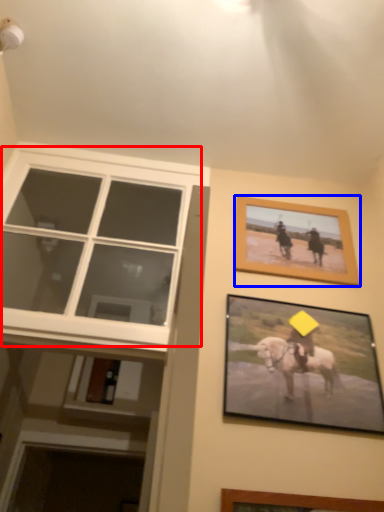
Question: Which object appears farthest to the camera in this image, window (highlighted by a red box) or picture frame (highlighted by a blue box)?

Choices:
 (A) window
 (B) picture frame

Answer: (B)